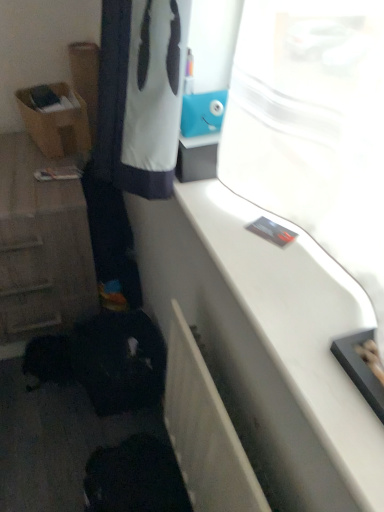
What are the coordinates of `empty space that is ontop of white glossy counter top at upper right (from a real-world perspective)` in the screenshot? It's located at (279, 266).